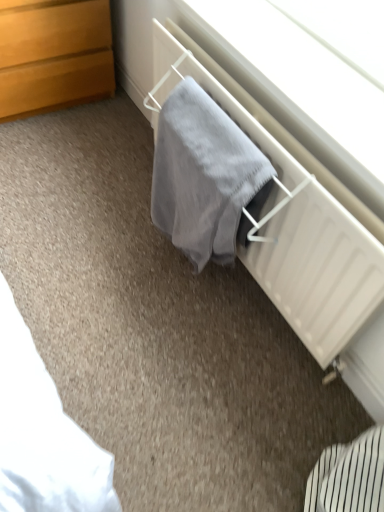
Question: Considering the relative positions of gray soft towel at center and gray fabric at center in the image provided, is gray soft towel at center to the left or to the right of gray fabric at center?

Choices:
 (A) right
 (B) left

Answer: (B)

Question: From a real-world perspective, is gray soft towel at center physically located above or below gray fabric at center?

Choices:
 (A) above
 (B) below

Answer: (B)

Question: Based on their relative distances, which object is nearer to the gray fabric at center?

Choices:
 (A) wooden chest of drawers at upper left
 (B) gray soft towel at center

Answer: (B)

Question: Which is farther from the gray soft towel at center?

Choices:
 (A) wooden chest of drawers at upper left
 (B) gray fabric at center

Answer: (A)